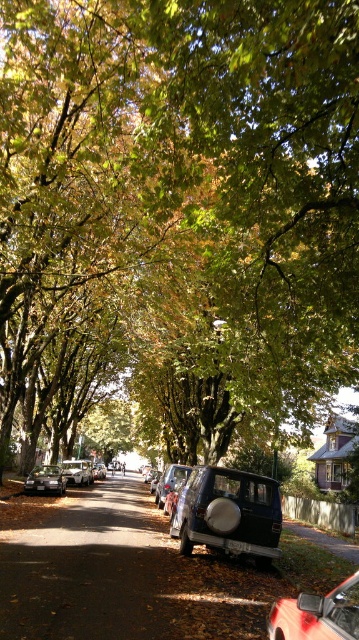
Can you confirm if matte black suv at center is smaller than metallic silver suv at center?

Yes, matte black suv at center is smaller than metallic silver suv at center.

Looking at this image, is matte black suv at center to the right of metallic silver suv at center from the viewer's perspective?

Yes, matte black suv at center is to the right of metallic silver suv at center.

Between point (213, 516) and point (180, 465), which one is positioned in front?

Point (213, 516) is more forward.

At what (x,y) coordinates should I click in order to perform the action: click on matte black suv at center. Please return your answer as a coordinate pair (x, y). This screenshot has width=359, height=640. Looking at the image, I should click on (x=229, y=513).

Which of these two, shiny silver sedan at lower left or metallic silver suv at center, stands shorter?

shiny silver sedan at lower left

Can you confirm if shiny silver sedan at lower left is shorter than metallic silver suv at center?

Yes.

The width and height of the screenshot is (359, 640). What do you see at coordinates (44, 481) in the screenshot?
I see `shiny silver sedan at lower left` at bounding box center [44, 481].

I want to click on shiny silver sedan at lower left, so click(x=44, y=481).

Can you confirm if metallic silver suv at center is positioned below matte black car at center?

No, metallic silver suv at center is not below matte black car at center.

Is metallic silver suv at center positioned at the back of matte black car at center?

No, it is in front of matte black car at center.

Does point (170, 490) come behind point (75, 483)?

No, it is in front of (75, 483).

Where is `metallic silver suv at center`? metallic silver suv at center is located at coordinates (170, 481).